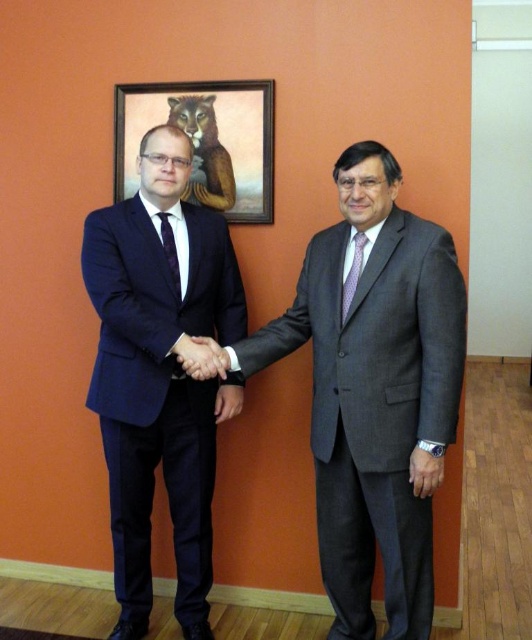
Who is positioned more to the right, matte black hand at center or purple silk tie at right?

From the viewer's perspective, purple silk tie at right appears more on the right side.

Does matte black hand at center have a smaller size compared to purple silk tie at right?

No.

You are a GUI agent. You are given a task and a screenshot of the screen. Output one action in this format:
    pyautogui.click(x=<x>, y=<y>)
    Task: Click on the matte black hand at center
    This screenshot has width=532, height=640.
    Given the screenshot: What is the action you would take?
    pyautogui.click(x=201, y=356)

Find the location of a particular element. The height and width of the screenshot is (640, 532). matte black hand at center is located at coordinates pyautogui.click(x=201, y=356).

Between navy blue suit at left and matte black hand at center, which one has more height?

navy blue suit at left is taller.

This screenshot has width=532, height=640. Describe the element at coordinates (160, 376) in the screenshot. I see `navy blue suit at left` at that location.

Who is more forward, (153, 436) or (195, 337)?

Positioned in front is point (195, 337).

Identify the location of navy blue suit at left. (160, 376).

Which is more to the right, navy blue suit at left or purple silk tie at right?

Positioned to the right is purple silk tie at right.

Can you confirm if navy blue suit at left is wider than purple silk tie at right?

Yes.

Image resolution: width=532 pixels, height=640 pixels. Identify the location of navy blue suit at left. (160, 376).